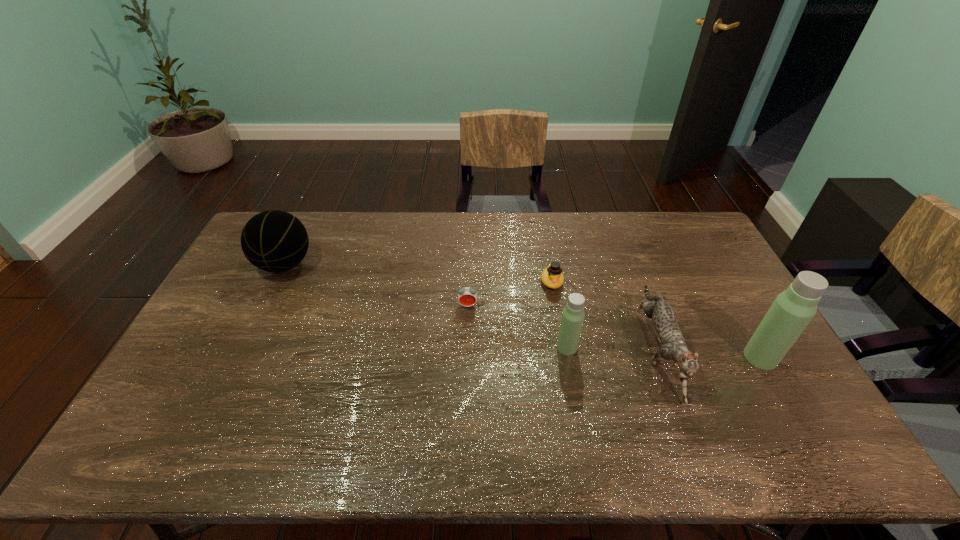
Please point a spot on the left to add another thermos bottle. Please provide its 2D coordinates. Your answer should be formatted as a tuple, i.e. [(x, y)], where the tuple contains the x and y coordinates of a point satisfying the conditions above.

[(381, 338)]